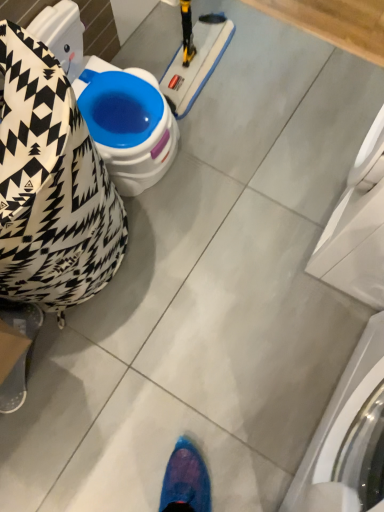
Question: From a real-world perspective, is black and white patterned bean bag chair at left physically located above or below white glossy washing machine at lower right, arranged as the 1th washing machine when ordered from the bottom?

Choices:
 (A) above
 (B) below

Answer: (B)

Question: Considering the positions of point pos(11,203) and point pos(354,354), is point pos(11,203) closer or farther from the camera than point pos(354,354)?

Choices:
 (A) farther
 (B) closer

Answer: (B)

Question: Which object is the farthest from the black and white patterned bean bag chair at left?

Choices:
 (A) white glossy washing machine at lower right, arranged as the 1th washing machine when ordered from the bottom
 (B) white glossy washing machine at right, arranged as the first washing machine when viewed from the top

Answer: (A)

Question: Considering the real-world distances, which object is closest to the black and white patterned bean bag chair at left?

Choices:
 (A) white glossy washing machine at right, arranged as the first washing machine when viewed from the top
 (B) white glossy washing machine at lower right, which is the second washing machine from top to bottom

Answer: (A)